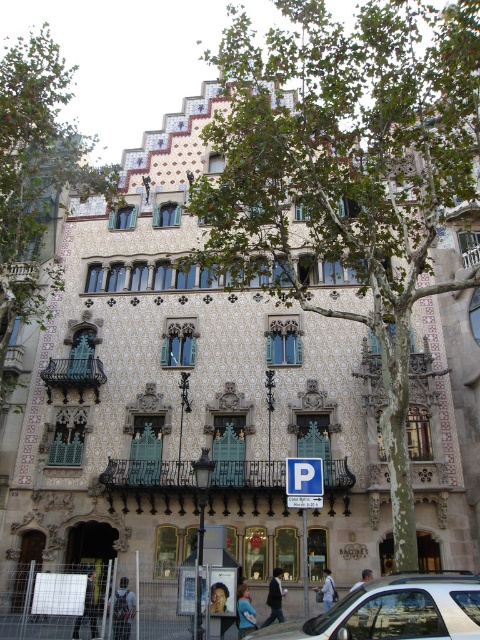
You are standing in front of the building and want to place your dark gray fabric backpack at lower left near the green leafy tree at upper left. Is the backpack closer to you or farther away compared to the tree?

The green leafy tree at upper left is further to the viewer than the dark gray fabric backpack at lower left, so the backpack is farther away from you compared to the tree.

You are standing in front of the historical building and notice a dark gray fabric backpack at lower left and a light blue denim jacket at center. Which object is shorter in height?

The dark gray fabric backpack at lower left is not as tall as the light blue denim jacket at center, so the dark gray fabric backpack at lower left is shorter in height.